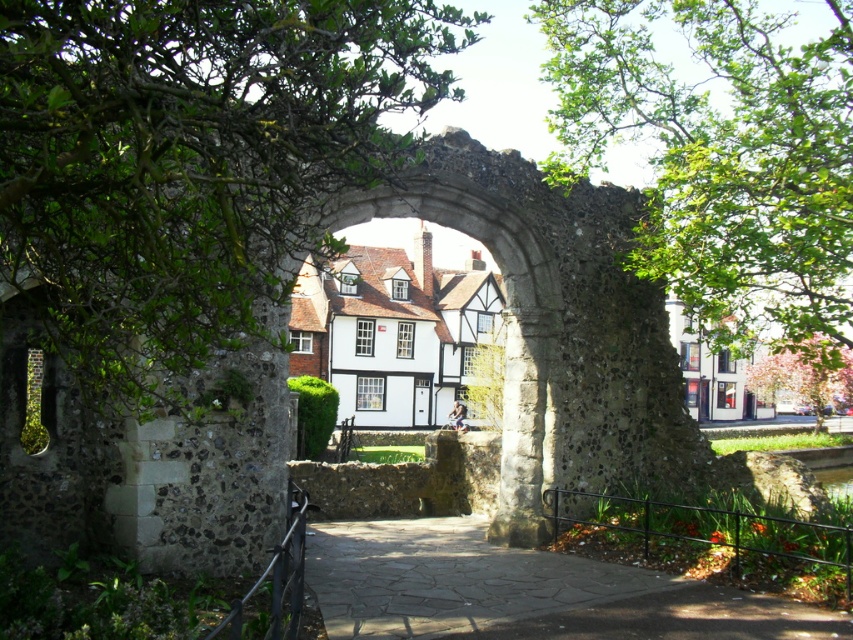
Question: Is green leafy tree at center thinner than paved stone path at center?

Choices:
 (A) no
 (B) yes

Answer: (B)

Question: Which object is closer to the camera taking this photo?

Choices:
 (A) green leafy tree at center
 (B) paved stone path at center

Answer: (A)

Question: Which object is farther from the camera taking this photo?

Choices:
 (A) paved stone path at center
 (B) green leafy tree at center

Answer: (A)

Question: Estimate the real-world distances between objects in this image. Which object is closer to the green leafy tree at center?

Choices:
 (A) pink blossoming tree at right
 (B) paved stone path at center
 (C) green leafy tree at upper right

Answer: (B)

Question: Can you confirm if green leafy tree at upper right is positioned below paved stone path at center?

Choices:
 (A) yes
 (B) no

Answer: (B)

Question: From the image, what is the correct spatial relationship of green leafy tree at center in relation to paved stone path at center?

Choices:
 (A) below
 (B) above

Answer: (B)